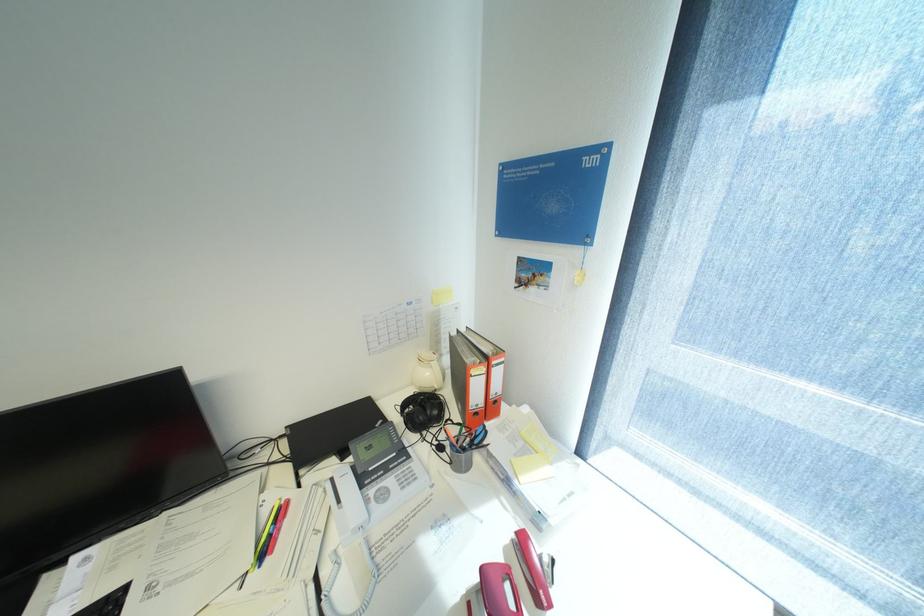
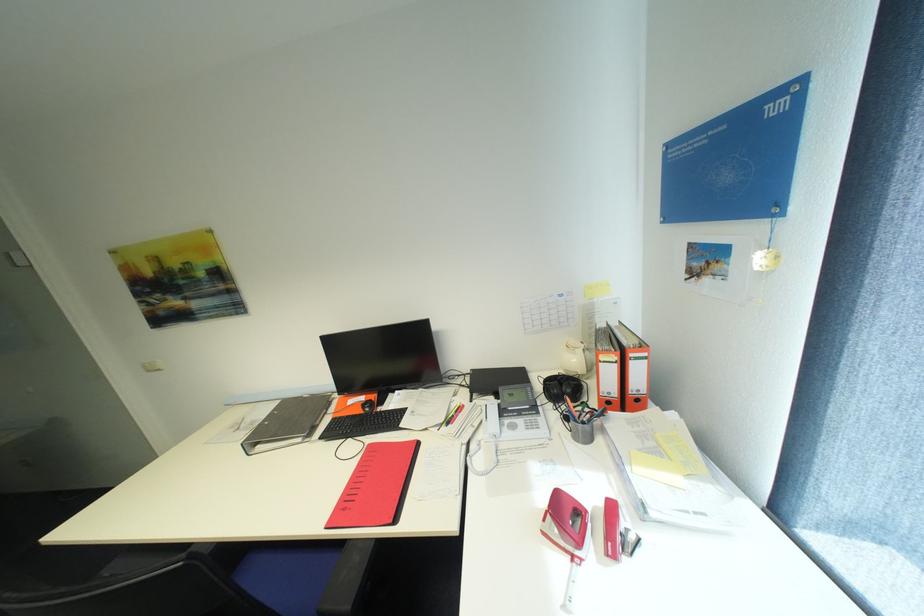
Question: Based on the continuous images, in which direction is the camera rotating? Reply with the corresponding letter.

Choices:
 (A) Left
 (B) Right
 (C) Up
 (D) Down

Answer: (A)